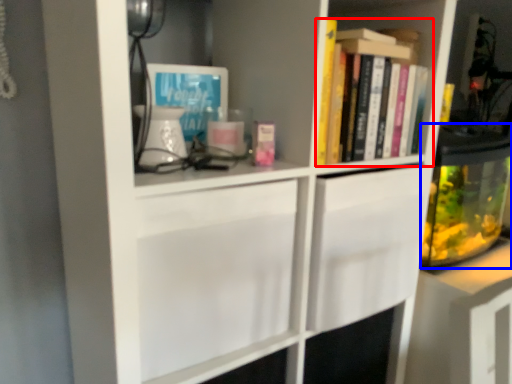
Question: Which object is further to the camera taking this photo, book (highlighted by a red box) or glass jar (highlighted by a blue box)?

Choices:
 (A) book
 (B) glass jar

Answer: (B)